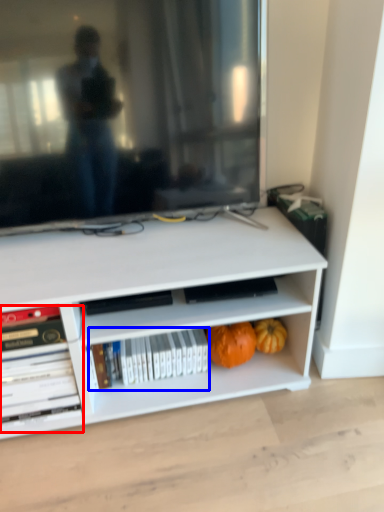
Question: Among these objects, which one is farthest to the camera, book (highlighted by a red box) or book (highlighted by a blue box)?

Choices:
 (A) book
 (B) book

Answer: (B)